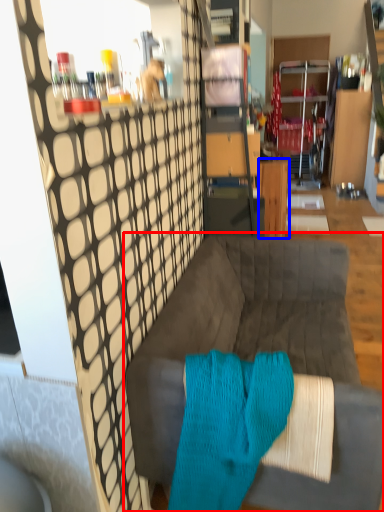
Question: Which of the following is the closest to the observer, studio couch (highlighted by a red box) or table (highlighted by a blue box)?

Choices:
 (A) studio couch
 (B) table

Answer: (A)